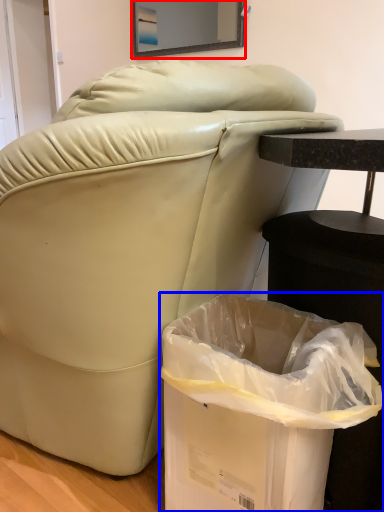
Question: Which object is closer to the camera taking this photo, mirror (highlighted by a red box) or trash bin/can (highlighted by a blue box)?

Choices:
 (A) mirror
 (B) trash bin/can

Answer: (B)